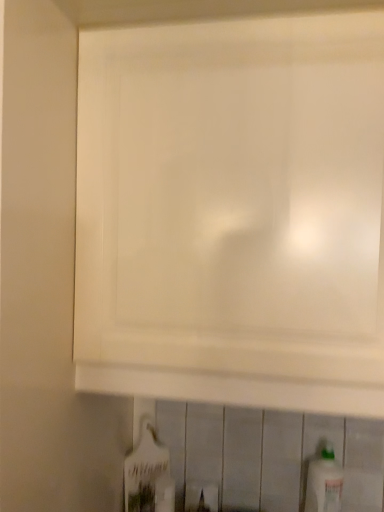
Question: Can you confirm if white matte cabinet at upper center is shorter than white plastic bottle at lower right, the first bottle positioned from the right?

Choices:
 (A) yes
 (B) no

Answer: (B)

Question: Can you confirm if white matte cabinet at upper center is taller than white plastic bottle at lower right, the first bottle positioned from the right?

Choices:
 (A) yes
 (B) no

Answer: (A)

Question: Is white matte cabinet at upper center wider than white plastic bottle at lower right, which is the 2th bottle from left to right?

Choices:
 (A) yes
 (B) no

Answer: (A)

Question: From the image's perspective, does white matte cabinet at upper center appear lower than white plastic bottle at lower right, which is the 2th bottle from left to right?

Choices:
 (A) no
 (B) yes

Answer: (A)

Question: Could white plastic bottle at lower right, which is the 2th bottle from left to right, be considered to be inside white matte cabinet at upper center?

Choices:
 (A) yes
 (B) no

Answer: (B)

Question: Can you confirm if white matte cabinet at upper center is smaller than white plastic bottle at lower right, the first bottle positioned from the right?

Choices:
 (A) yes
 (B) no

Answer: (B)

Question: Would you consider white glossy bottle at lower center, which ranks as the 1th bottle in left-to-right order, to be distant from white matte cabinet at upper center?

Choices:
 (A) yes
 (B) no

Answer: (B)

Question: Does white glossy bottle at lower center, which is the 2th bottle in right-to-left order, have a lesser height compared to white matte cabinet at upper center?

Choices:
 (A) yes
 (B) no

Answer: (A)

Question: Can you confirm if white glossy bottle at lower center, which ranks as the 1th bottle in left-to-right order, is positioned to the right of white matte cabinet at upper center?

Choices:
 (A) yes
 (B) no

Answer: (B)

Question: Could white matte cabinet at upper center be considered to be inside white glossy bottle at lower center, which ranks as the 1th bottle in left-to-right order?

Choices:
 (A) no
 (B) yes

Answer: (A)

Question: Is white glossy bottle at lower center, which is the 2th bottle in right-to-left order, wider than white matte cabinet at upper center?

Choices:
 (A) yes
 (B) no

Answer: (B)

Question: Is white glossy bottle at lower center, which is the 2th bottle in right-to-left order, directly adjacent to white matte cabinet at upper center?

Choices:
 (A) no
 (B) yes

Answer: (A)

Question: Is the depth of white matte cabinet at upper center greater than that of white glossy bottle at lower center, which ranks as the 1th bottle in left-to-right order?

Choices:
 (A) yes
 (B) no

Answer: (B)